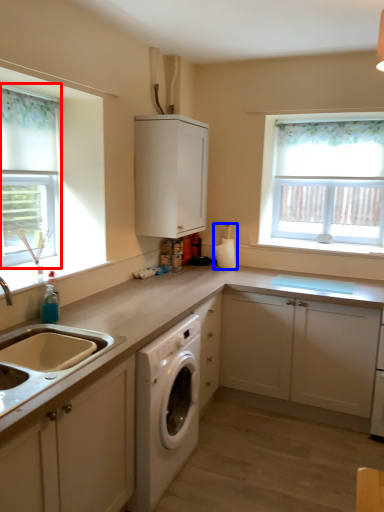
Question: Which object appears closest to the camera in this image, bay window (highlighted by a red box) or appliance (highlighted by a blue box)?

Choices:
 (A) bay window
 (B) appliance

Answer: (A)